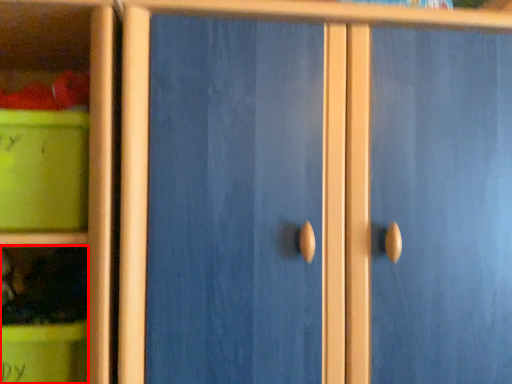
Question: From the image's perspective, where is cabinet (annotated by the red box) located in relation to storage box in the image?

Choices:
 (A) below
 (B) above

Answer: (A)